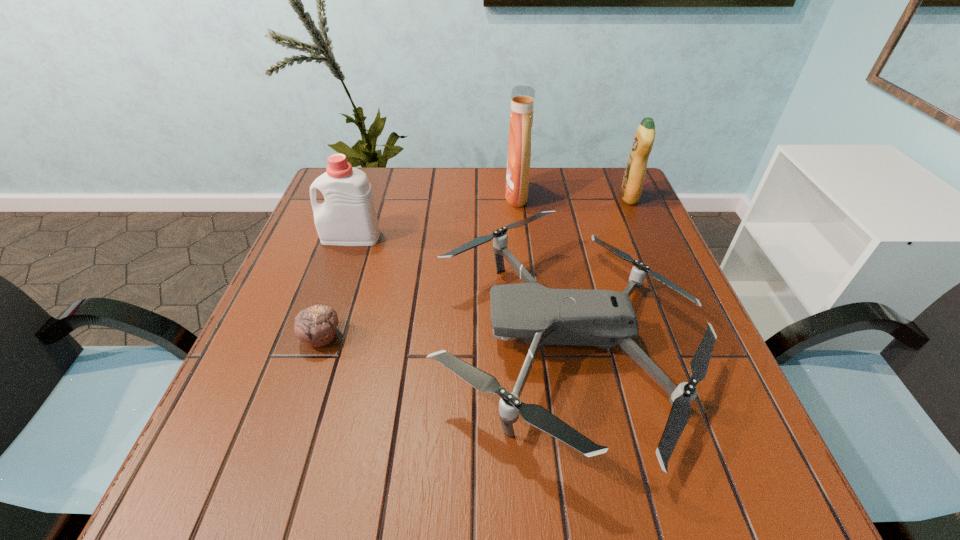
This screenshot has width=960, height=540. In the image, there is a desktop. In order to click on vacant space at the far right corner in this screenshot , I will do `click(586, 187)`.

You are a GUI agent. You are given a task and a screenshot of the screen. Output one action in this format:
    pyautogui.click(x=<x>, y=<y>)
    Task: Click on the unoccupied position between the leftmost detergent and the tallest detergent
    The width and height of the screenshot is (960, 540).
    Given the screenshot: What is the action you would take?
    pyautogui.click(x=434, y=217)

The height and width of the screenshot is (540, 960). What are the coordinates of `free space that is in between the second shortest object and the shortest object` in the screenshot? It's located at (444, 339).

Where is `vacant space in between the muffin and the nearest detergent`? vacant space in between the muffin and the nearest detergent is located at coordinates (336, 287).

I want to click on free space between the rightmost detergent and the shortest object, so click(x=475, y=267).

Identify the location of empty space between the shortest object and the tallest detergent. The image size is (960, 540). (419, 267).

You are a GUI agent. You are given a task and a screenshot of the screen. Output one action in this format:
    pyautogui.click(x=<x>, y=<y>)
    Task: Click on the empty space that is in between the muffin and the rightmost detergent
    
    Given the screenshot: What is the action you would take?
    pyautogui.click(x=475, y=267)

You are a GUI agent. You are given a task and a screenshot of the screen. Output one action in this format:
    pyautogui.click(x=<x>, y=<y>)
    Task: Click on the vacant area that lies between the rightmost detergent and the muffin
    
    Given the screenshot: What is the action you would take?
    pyautogui.click(x=475, y=267)

Find the location of a particular element. This screenshot has height=540, width=960. vacant area between the rightmost detergent and the second detergent from left to right is located at coordinates (573, 197).

Locate an element on the screen. vacant region between the nearest detergent and the fourth tallest object is located at coordinates (458, 289).